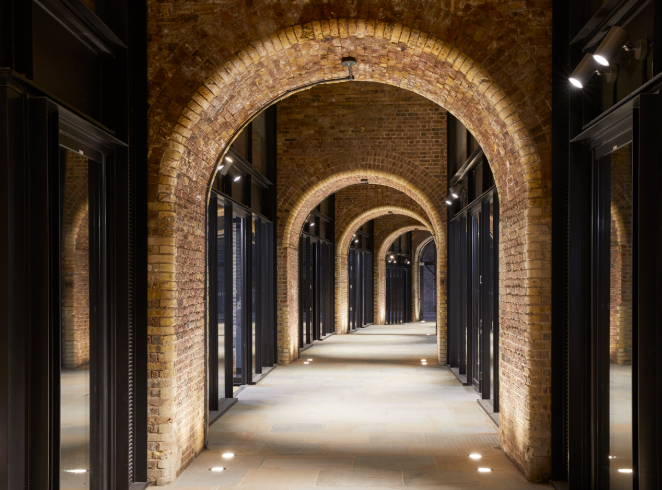
I want to click on windows, so click(261, 145), click(243, 145), click(459, 139), click(473, 142).